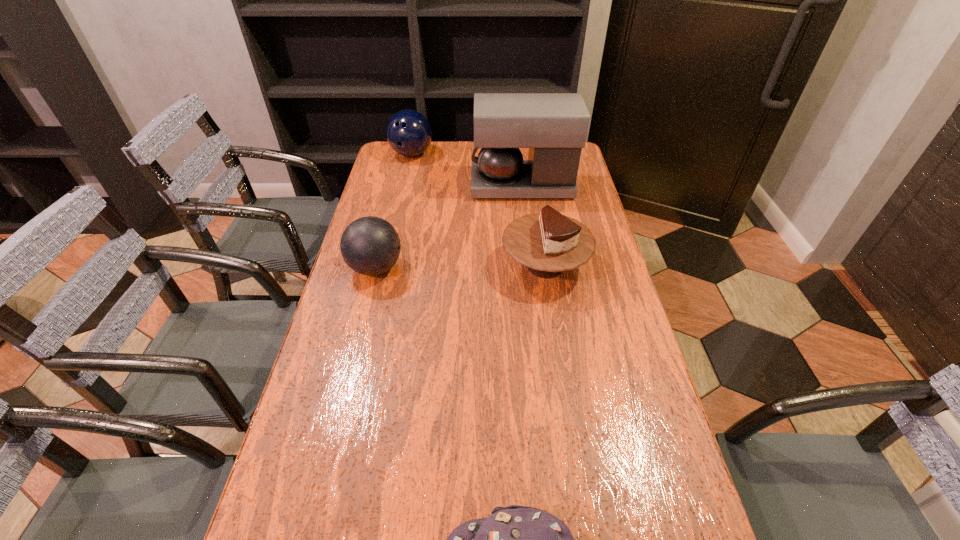
Identify the location of vacant area that lies between the second farthest object and the nearer bowling ball. (449, 227).

The image size is (960, 540). Find the location of `unoccupied position between the nearer bowling ball and the cake`. unoccupied position between the nearer bowling ball and the cake is located at coordinates (461, 267).

You are a GUI agent. You are given a task and a screenshot of the screen. Output one action in this format:
    pyautogui.click(x=<x>, y=<y>)
    Task: Click on the vacant space that's between the farther bowling ball and the nearer bowling ball
    
    Given the screenshot: What is the action you would take?
    pyautogui.click(x=394, y=211)

Identify which object is the second nearest to the cake. Please provide its 2D coordinates. Your answer should be formatted as a tuple, i.e. [(x, y)], where the tuple contains the x and y coordinates of a point satisfying the conditions above.

[(370, 245)]

Where is `object that can be found as the closest to the second farthest object`? Image resolution: width=960 pixels, height=540 pixels. object that can be found as the closest to the second farthest object is located at coordinates (408, 132).

Find the location of a particular element. The height and width of the screenshot is (540, 960). vacant position in the image that satisfies the following two spatial constraints: 1. on the surface of the cake near the finger holes; 2. on the right side of the farthest object is located at coordinates (386, 266).

At what (x,y) coordinates should I click in order to perform the action: click on free space that satisfies the following two spatial constraints: 1. on the carafe side of the coffee maker; 2. on the back side of the cake. Please return your answer as a coordinate pair (x, y). This screenshot has width=960, height=540. Looking at the image, I should click on (533, 266).

At what (x,y) coordinates should I click in order to perform the action: click on free space that satisfies the following two spatial constraints: 1. on the back side of the cake; 2. on the carafe side of the second farthest object. Please return your answer as a coordinate pair (x, y). Looking at the image, I should click on (533, 186).

Locate an element on the screen. vacant point that satisfies the following two spatial constraints: 1. on the carafe side of the cake; 2. on the left side of the second farthest object is located at coordinates (533, 266).